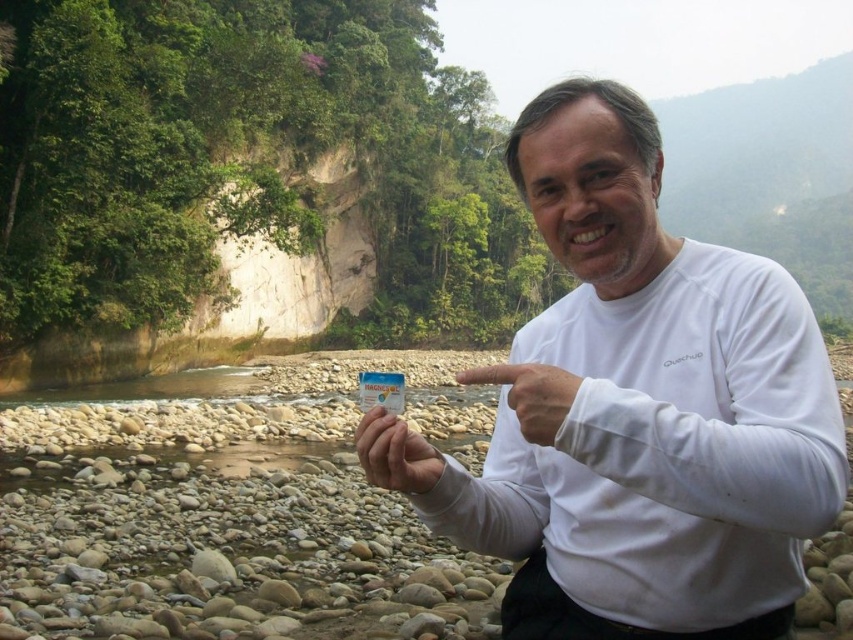
What is the position of the white matte card at center in the image?

The white matte card at center is located at point (395, 452).

From the picture: You are a photographer taking a picture of the man holding the white matte card at center and the white matte hand at center. Which object is thinner when viewed from your camera angle?

The white matte card at center is thinner than the white matte hand at center.